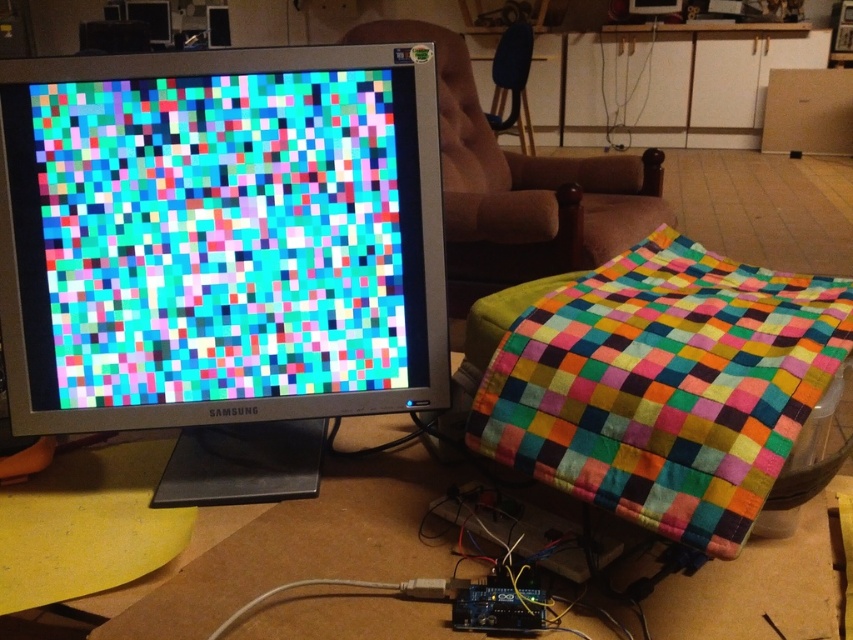
Question: Does matte plastic monitor at left lie behind white glossy cabinet at upper center?

Choices:
 (A) yes
 (B) no

Answer: (B)

Question: Considering the relative positions of multicolored quilt at center and velvet brown armchair at upper center in the image provided, where is multicolored quilt at center located with respect to velvet brown armchair at upper center?

Choices:
 (A) above
 (B) below

Answer: (B)

Question: Which of the following is the farthest from the observer?

Choices:
 (A) velvet brown armchair at upper center
 (B) multicolored quilt at center

Answer: (A)

Question: Among these points, which one is farthest from the camera?

Choices:
 (A) (492, 118)
 (B) (35, 285)
 (C) (635, 224)
 (D) (415, 605)

Answer: (A)

Question: Which of these objects is positioned closest to the matte plastic monitor at left?

Choices:
 (A) white glossy cabinet at upper center
 (B) velvet brown armchair at upper center
 (C) brown fabric armchair at center

Answer: (C)

Question: Is multicolored quilt at center behind cardboard at lower left?

Choices:
 (A) no
 (B) yes

Answer: (A)